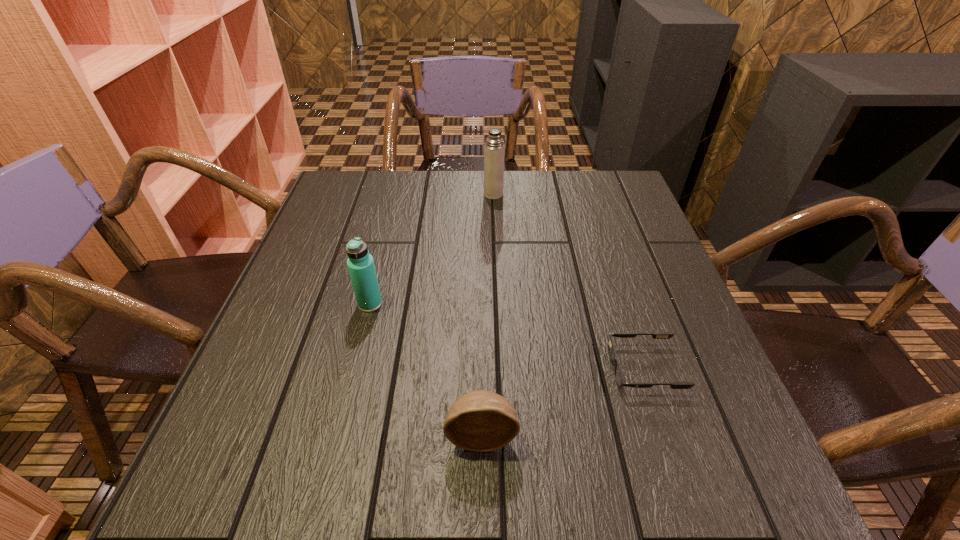
Find the location of a particular element. The width and height of the screenshot is (960, 540). vacant space at the far right corner of the desktop is located at coordinates (639, 215).

This screenshot has height=540, width=960. In the image, there is a desktop. Identify the location of free space at the near right corner. (664, 480).

Image resolution: width=960 pixels, height=540 pixels. I want to click on vacant area between the left thermos bottle and the right thermos bottle, so click(x=432, y=249).

Find the location of a particular element. Image resolution: width=960 pixels, height=540 pixels. vacant area that lies between the sunglasses and the left thermos bottle is located at coordinates (507, 336).

This screenshot has height=540, width=960. Find the location of `blank region between the farther thermos bottle and the bowl`. blank region between the farther thermos bottle and the bowl is located at coordinates (488, 315).

Identify the location of free spot between the left thermos bottle and the nearest object. (426, 369).

This screenshot has height=540, width=960. Find the location of `vacant region between the third nearest object and the farthest object`. vacant region between the third nearest object and the farthest object is located at coordinates (432, 249).

Locate an element on the screen. The height and width of the screenshot is (540, 960). free space between the nearer thermos bottle and the nearest object is located at coordinates (426, 369).

Find the location of a particular element. empty space that is in between the right thermos bottle and the sunglasses is located at coordinates pyautogui.click(x=569, y=281).

Where is `vacant space that is in between the second shortest object and the left thermos bottle`? The image size is (960, 540). vacant space that is in between the second shortest object and the left thermos bottle is located at coordinates (426, 369).